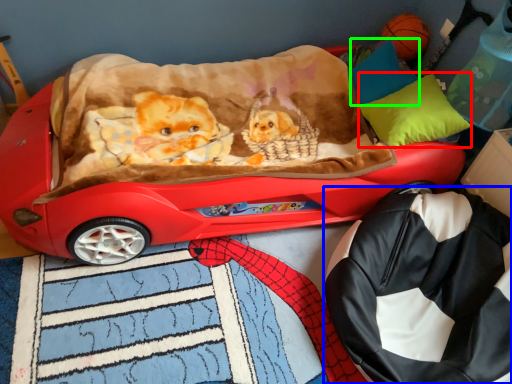
Question: Based on their relative distances, which object is farther from pillow (highlighted by a red box)? Choose from bag (highlighted by a blue box) and pillow (highlighted by a green box).

Choices:
 (A) bag
 (B) pillow

Answer: (A)